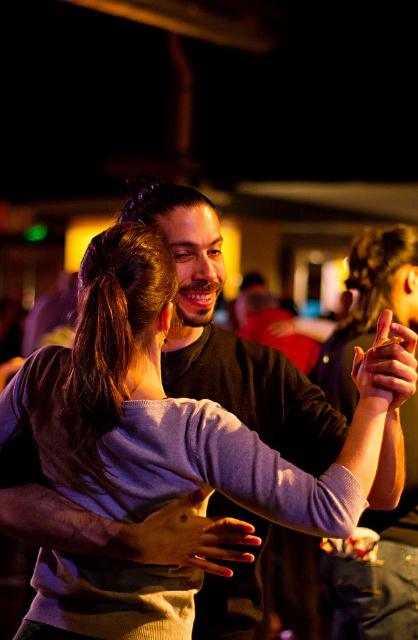
Which is below, purple sweater at center or smooth skin hand at center?

Result: smooth skin hand at center is lower down.

Which is more to the left, purple sweater at center or smooth skin hand at center?

smooth skin hand at center

Locate an element on the screen. purple sweater at center is located at coordinates (382, 561).

Is purple ribbed sweater at center taller than brown hair at center?

Correct, purple ribbed sweater at center is much taller as brown hair at center.

This screenshot has width=418, height=640. What do you see at coordinates (229, 337) in the screenshot? I see `purple ribbed sweater at center` at bounding box center [229, 337].

Where is `purple ribbed sweater at center`? purple ribbed sweater at center is located at coordinates (229, 337).

Does purple ribbed sweater at center have a greater height compared to matte purple sweater at center?

Yes.

Does purple ribbed sweater at center have a lesser height compared to matte purple sweater at center?

No, purple ribbed sweater at center is not shorter than matte purple sweater at center.

Is point (298, 420) in front of point (195, 499)?

No.

Identify the location of purple ribbed sweater at center. This screenshot has height=640, width=418. (229, 337).